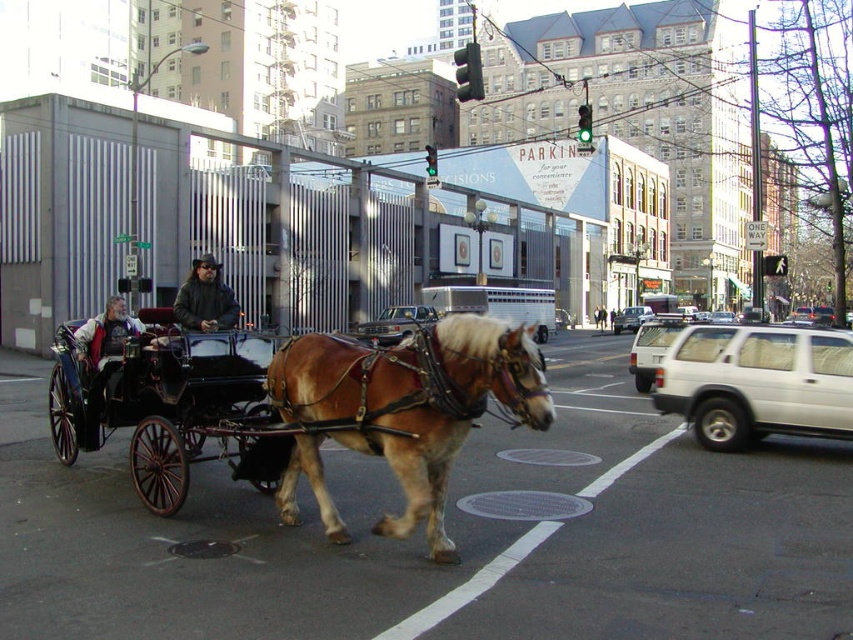
Question: Is white matte suv at right bigger than white matte suv at center?

Choices:
 (A) yes
 (B) no

Answer: (B)

Question: Which object is the farthest from the white matte suv at right?

Choices:
 (A) white matte suv at center-right
 (B) brown glossy horse at center
 (C) gray wool jacket at left

Answer: (C)

Question: Does gray wool jacket at left have a greater width compared to metallic silver car at center?

Choices:
 (A) no
 (B) yes

Answer: (B)

Question: Is gray wool jacket at left bigger than white matte suv at center-right?

Choices:
 (A) yes
 (B) no

Answer: (B)

Question: Estimate the real-world distances between objects in this image. Which object is farther from the dark brown leather jacket at center?

Choices:
 (A) gray wool jacket at left
 (B) white matte suv at center
 (C) brown glossy horse at center
 (D) black polished wood wagon at left

Answer: (B)

Question: Which object is the closest to the white matte suv at center?

Choices:
 (A) white matte suv at center-right
 (B) metallic silver car at center

Answer: (A)